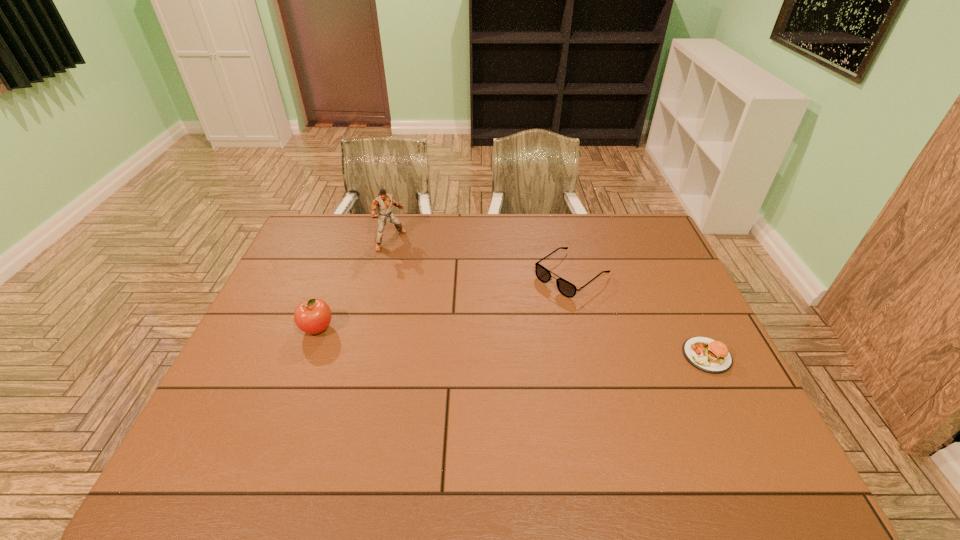
Identify the location of free space on the desktop that is between the second tallest object and the rightmost object and is positioned on the front-facing side of the third object from left to right. The width and height of the screenshot is (960, 540). (482, 340).

What are the coordinates of `vacant space on the desktop that is between the apple and the shortest object and is positioned on the front-facing side of the tallest object` in the screenshot? It's located at (533, 343).